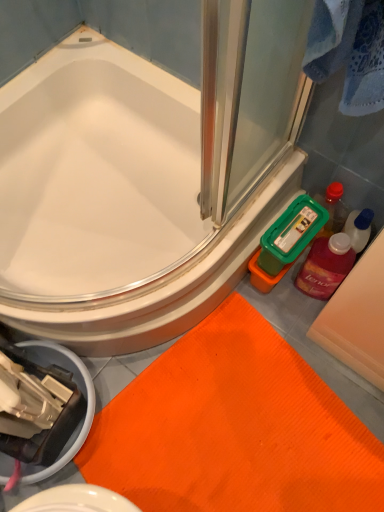
Locate an element on the screen. Image resolution: width=384 pixels, height=512 pixels. translucent plastic mouthwash at right is located at coordinates (326, 266).

Locate an element on the screen. The height and width of the screenshot is (512, 384). white glossy bathtub at upper left is located at coordinates (116, 202).

The height and width of the screenshot is (512, 384). In order to click on translucent plastic mouthwash at right in this screenshot , I will do `click(326, 266)`.

Which object is more forward, translucent plastic mouthwash at right or orange textured bath mat at lower center?

orange textured bath mat at lower center.

Between point (316, 270) and point (131, 497), which one is positioned in front?

Positioned in front is point (131, 497).

At what (x,y) coordinates should I click in order to perform the action: click on bath mat located on the left of translucent plastic mouthwash at right. Please return your answer as a coordinate pair (x, y). The width and height of the screenshot is (384, 512). Looking at the image, I should click on tap(233, 429).

Measure the distance between translucent plastic mouthwash at right and orange textured bath mat at lower center.

translucent plastic mouthwash at right and orange textured bath mat at lower center are 15.50 inches apart.

From the image's perspective, is translucent plastic mouthwash at right over white glossy bathtub at upper left?

No.

Is translucent plastic mouthwash at right shorter than white glossy bathtub at upper left?

No.

Can you confirm if translucent plastic mouthwash at right is thinner than white glossy bathtub at upper left?

Yes.

Is translucent plastic mouthwash at right facing away from white glossy bathtub at upper left?

No, translucent plastic mouthwash at right is not facing the opposite direction of white glossy bathtub at upper left.

In the image, is white glossy bathtub at upper left positioned in front of or behind translucent plastic mouthwash at right?

Clearly, white glossy bathtub at upper left is in front of translucent plastic mouthwash at right.

Looking at this image, could you tell me if white glossy bathtub at upper left is turned towards translucent plastic mouthwash at right?

Yes, white glossy bathtub at upper left is aimed at translucent plastic mouthwash at right.

Would you say white glossy bathtub at upper left is outside translucent plastic mouthwash at right?

Yes, white glossy bathtub at upper left is located beyond the bounds of translucent plastic mouthwash at right.

What's the angular difference between white glossy bathtub at upper left and translucent plastic mouthwash at right's facing directions?

They differ by 90.3 degrees in their facing directions.

Is orange textured bath mat at lower center next to translucent plastic mouthwash at right and touching it?

No.

From the image's perspective, which object appears higher, orange textured bath mat at lower center or translucent plastic mouthwash at right?

translucent plastic mouthwash at right is shown above in the image.

Does orange textured bath mat at lower center turn towards translucent plastic mouthwash at right?

No, orange textured bath mat at lower center is not turned towards translucent plastic mouthwash at right.

From the picture: Would you say white glossy bathtub at upper left is inside or outside orange textured bath mat at lower center?

white glossy bathtub at upper left is located beyond the bounds of orange textured bath mat at lower center.

Locate an element on the screen. Image resolution: width=384 pixels, height=512 pixels. bath mat located underneath the white glossy bathtub at upper left (from a real-world perspective) is located at coordinates (233, 429).

How much distance is there between white glossy bathtub at upper left and orange textured bath mat at lower center?

The distance of white glossy bathtub at upper left from orange textured bath mat at lower center is 15.86 inches.

Is white glossy bathtub at upper left closer to camera compared to orange textured bath mat at lower center?

Yes, white glossy bathtub at upper left is closer to the viewer.

What's the angular difference between orange textured bath mat at lower center and white glossy bathtub at upper left's facing directions?

The angular difference between orange textured bath mat at lower center and white glossy bathtub at upper left is 11.2 degrees.

Is orange textured bath mat at lower center aimed at white glossy bathtub at upper left?

No, orange textured bath mat at lower center is not oriented towards white glossy bathtub at upper left.

From a real-world perspective, between orange textured bath mat at lower center and white glossy bathtub at upper left, who is vertically higher?

white glossy bathtub at upper left, from a real-world perspective.

Measure the distance from orange textured bath mat at lower center to white glossy bathtub at upper left.

15.86 inches.

Locate an element on the screen. bath mat in front of the translucent plastic mouthwash at right is located at coordinates (233, 429).

I want to click on mouthwash below the white glossy bathtub at upper left (from the image's perspective), so click(326, 266).

Looking at this image, based on their spatial positions, is orange textured bath mat at lower center or translucent plastic mouthwash at right closer to white glossy bathtub at upper left?

orange textured bath mat at lower center is closer to white glossy bathtub at upper left.

Looking at the image, which one is located closer to translucent plastic mouthwash at right, white glossy bathtub at upper left or orange textured bath mat at lower center?

Based on the image, orange textured bath mat at lower center appears to be nearer to translucent plastic mouthwash at right.

In the scene shown: From the image, which object appears to be nearer to orange textured bath mat at lower center, white glossy bathtub at upper left or translucent plastic mouthwash at right?

Based on the image, translucent plastic mouthwash at right appears to be nearer to orange textured bath mat at lower center.

Which object lies nearer to the anchor point orange textured bath mat at lower center, translucent plastic mouthwash at right or white glossy bathtub at upper left?

translucent plastic mouthwash at right is closer to orange textured bath mat at lower center.

Estimate the real-world distances between objects in this image. Which object is closer to white glossy bathtub at upper left, translucent plastic mouthwash at right or orange textured bath mat at lower center?

The object closer to white glossy bathtub at upper left is orange textured bath mat at lower center.

Based on their spatial positions, is orange textured bath mat at lower center or white glossy bathtub at upper left further from translucent plastic mouthwash at right?

white glossy bathtub at upper left lies further to translucent plastic mouthwash at right than the other object.

The image size is (384, 512). Identify the location of mouthwash between white glossy bathtub at upper left and orange textured bath mat at lower center vertically. (326, 266).